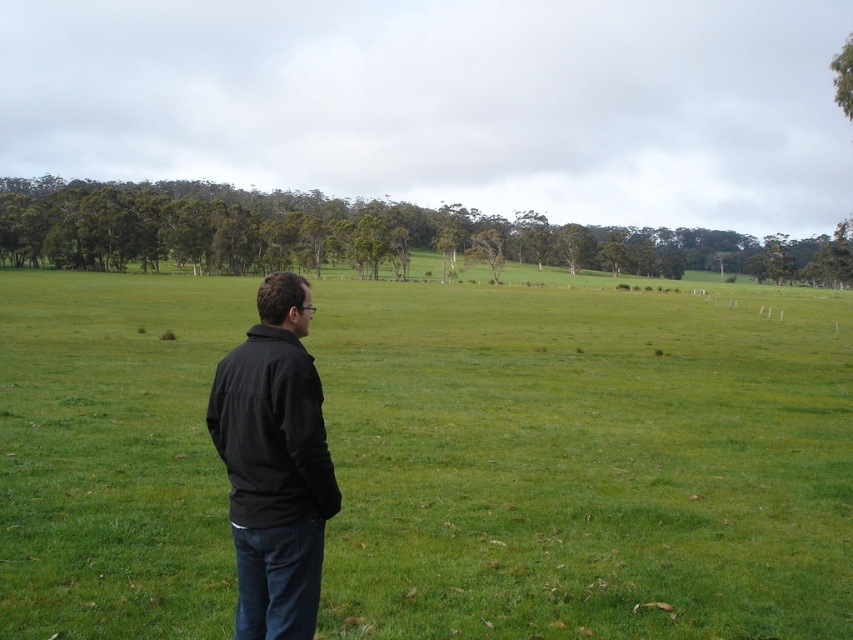
You are standing on the green grass pasture at center and want to walk to the black matte jacket at left. Which direction should you face to move towards it?

Since the green grass pasture at center is to the right of the black matte jacket at left, you should face left to move towards the black matte jacket at left.

You are a drone operator trying to capture the best aerial shot of the green grass pasture at center. The drone has a GPS coordinate system where the origin is at the bottom left corner of the image. The pasture is at coordinates point 0.722, 0.687. If you want to position the drone directly above the pasture, what coordinates should you set for the drone?

The drone should be positioned at coordinates point [585,461] to be directly above the green grass pasture at center.

You are a photographer planning to take a photo of the two points marked in the image. The points are located at coordinates point (608, 634) and point (236, 634). Based on the scene description, which point is closer to the camera?

Point (608, 634) is closer to the camera than point (236, 634) because it is further to the camera according to the description.